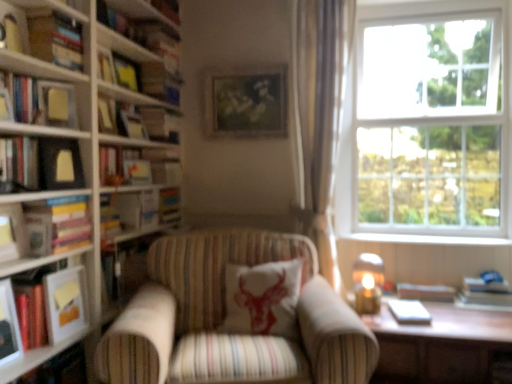
I want to click on free space in front of white matte paperback book at lower right, the first paperback book when ordered from bottom to top, so click(x=422, y=327).